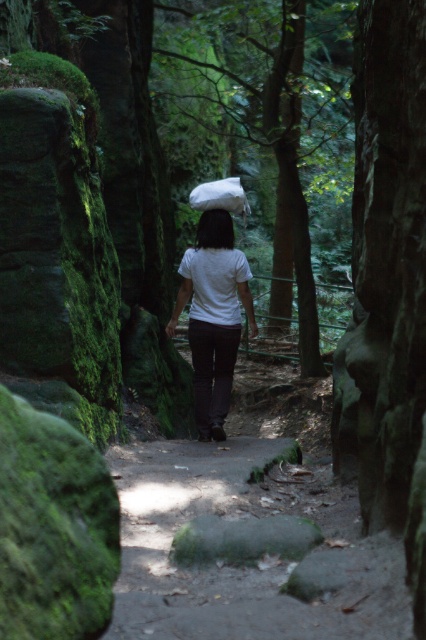
You are a hiker trying to walk along the smooth dirt path at center while wearing the white matte shirt at center. Do you think the path is wide enough for you to walk comfortably without stepping off the path?

The smooth dirt path at center is wider than the white matte shirt at center, so yes, the path is wide enough for you to walk comfortably without stepping off the path.

You are a photographer standing in the forest. You want to take a photo of the smooth dirt path at center and the white matte shirt at center. Which object should you focus on first if you want to capture both in sharp focus?

The smooth dirt path at center is below white matte shirt at center, so you should focus on the white matte shirt at center first to ensure both are in sharp focus.